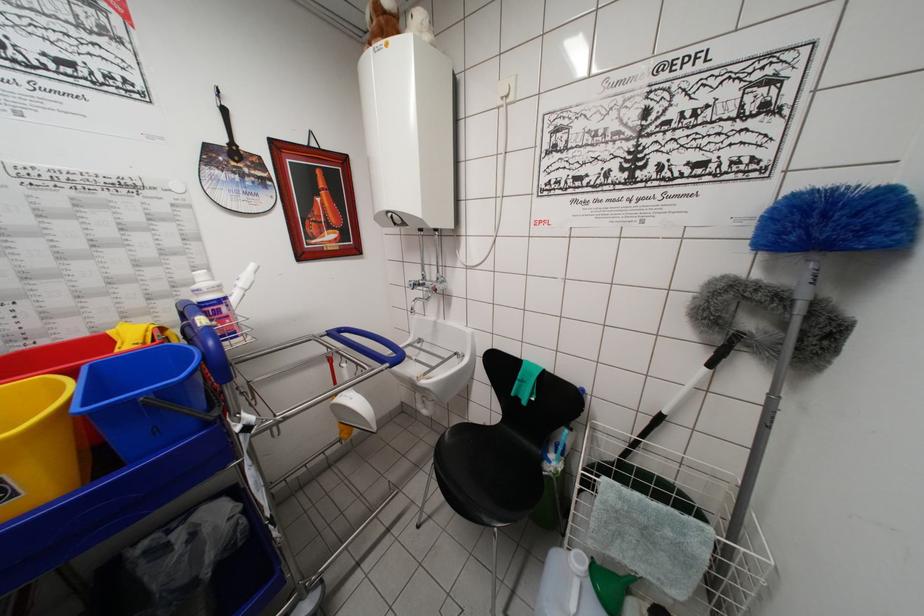
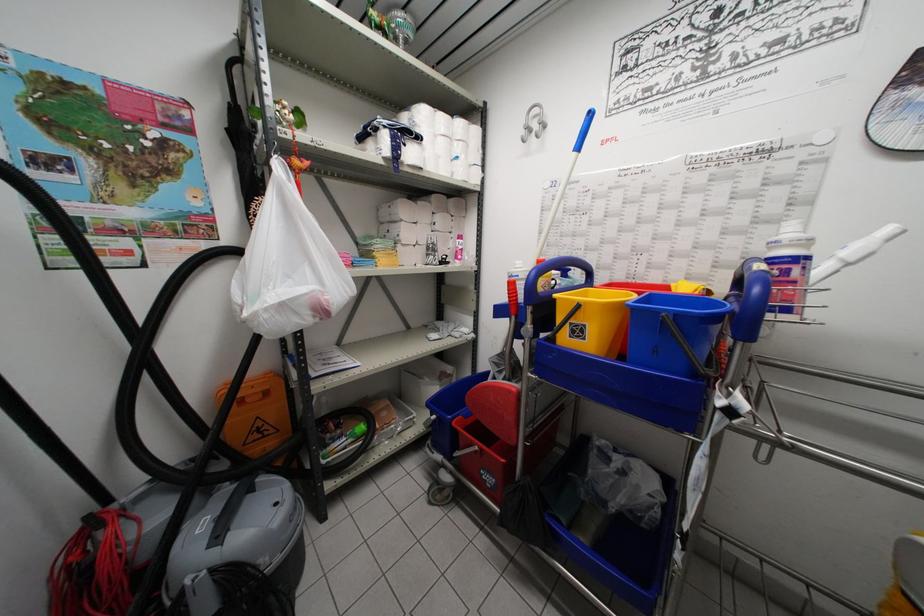
Question: The images are taken continuously from a first-person perspective. In which direction is your viewpoint rotating?

Choices:
 (A) Left
 (B) Right
 (C) Up
 (D) Down

Answer: (A)